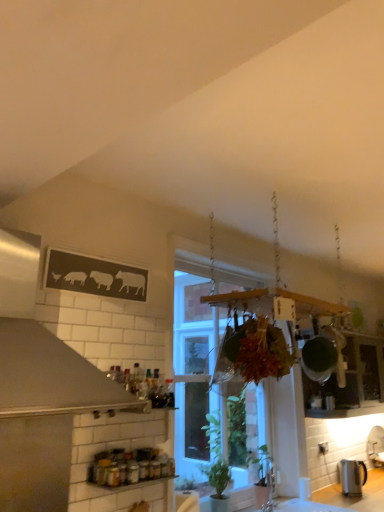
Find the location of a particular element. The width and height of the screenshot is (384, 512). satin silver kettle at lower right is located at coordinates (352, 477).

In order to face satin silver exhaust hood at upper left, should I rotate leftwards or rightwards?

Turn left approximately 18.641 degrees to face it.

What do you see at coordinates (194, 362) in the screenshot? I see `clear glass window at center` at bounding box center [194, 362].

At what (x,y) coordinates should I click in order to perform the action: click on satin silver kettle at lower right. Please return your answer as a coordinate pair (x, y). Looking at the image, I should click on (352, 477).

Based on their sizes in the image, would you say clear glass window at center is bigger or smaller than satin silver exhaust hood at upper left?

In the image, clear glass window at center appears to be larger than satin silver exhaust hood at upper left.

Is point (184, 480) closer or farther from the camera than point (48, 372)?

Point (184, 480) appears to be farther away from the viewer than point (48, 372).

Where is `window located below the satin silver exhaust hood at upper left (from the image's perspective)`? The image size is (384, 512). window located below the satin silver exhaust hood at upper left (from the image's perspective) is located at coordinates (194, 362).

Find the location of a particular element. This screenshot has height=512, width=384. window in front of the satin silver kettle at lower right is located at coordinates (194, 362).

Can you tell me how much satin silver kettle at lower right and clear glass window at center differ in facing direction?

There is a 4.87-degree angle between the facing directions of satin silver kettle at lower right and clear glass window at center.

Does satin silver kettle at lower right touch clear glass window at center?

satin silver kettle at lower right is not next to clear glass window at center, and they're not touching.

From the image's perspective, relative to clear glass window at center, is satin silver kettle at lower right above or below?

satin silver kettle at lower right is situated lower than clear glass window at center in the image.

This screenshot has width=384, height=512. Find the location of `exhaust hood on the left of metallic glass jars at lower center`. exhaust hood on the left of metallic glass jars at lower center is located at coordinates click(x=42, y=350).

Would you say satin silver exhaust hood at upper left is a long distance from metallic glass jars at lower center?

No, satin silver exhaust hood at upper left is in close proximity to metallic glass jars at lower center.

Is the depth of clear glass window at center less than that of satin silver kettle at lower right?

Yes, clear glass window at center is closer to the viewer.

Based on their positions, is clear glass window at center located to the left or right of satin silver kettle at lower right?

clear glass window at center is positioned on satin silver kettle at lower right's left side.

Can we say clear glass window at center lies outside satin silver kettle at lower right?

Indeed, clear glass window at center is completely outside satin silver kettle at lower right.

Is clear glass window at center not close to satin silver kettle at lower right?

Absolutely, clear glass window at center is distant from satin silver kettle at lower right.

Is metallic glass jars at lower center positioned behind satin silver exhaust hood at upper left?

Yes, it is.

Is metallic glass jars at lower center not near satin silver exhaust hood at upper left?

metallic glass jars at lower center is near satin silver exhaust hood at upper left, not far away.

Considering the positions of points (141, 483) and (115, 385), is point (141, 483) farther from camera compared to point (115, 385)?

That is True.

Identify the location of window sill lying on the right of satin silver exhaust hood at upper left. This screenshot has height=512, width=384. (131, 484).

Is satin silver exhaust hood at upper left to the right of clear glass window at center from the viewer's perspective?

No.

From a real-world perspective, is satin silver exhaust hood at upper left on top of clear glass window at center?

Yes.

The height and width of the screenshot is (512, 384). In order to click on window below the satin silver exhaust hood at upper left (from a real-world perspective) in this screenshot , I will do `click(194, 362)`.

Is metallic glass jars at lower center not near clear glass window at center?

Yes, metallic glass jars at lower center is far from clear glass window at center.

From a real-world perspective, is metallic glass jars at lower center located higher than clear glass window at center?

Incorrect, from a real-world perspective, metallic glass jars at lower center is lower than clear glass window at center.

Consider the image. In terms of height, does metallic glass jars at lower center look taller or shorter compared to clear glass window at center?

Considering their sizes, metallic glass jars at lower center has less height than clear glass window at center.

Consider the image. Measure the distance between metallic glass jars at lower center and clear glass window at center.

metallic glass jars at lower center and clear glass window at center are 2.19 meters apart.

What are the coordinates of `window directly beneath the satin silver exhaust hood at upper left (from a real-world perspective)` in the screenshot? It's located at (194, 362).

Locate an element on the screen. The height and width of the screenshot is (512, 384). window above the satin silver kettle at lower right (from a real-world perspective) is located at coordinates (194, 362).

Based on their spatial positions, is satin silver exhaust hood at upper left or satin silver kettle at lower right closer to metallic glass jars at lower center?

satin silver exhaust hood at upper left is positioned closer to the anchor metallic glass jars at lower center.

Estimate the real-world distances between objects in this image. Which object is closer to satin silver exhaust hood at upper left, clear glass window at center or metallic glass jars at lower center?

Among the two, metallic glass jars at lower center is located nearer to satin silver exhaust hood at upper left.

Based on their spatial positions, is satin silver kettle at lower right or metallic glass jars at lower center closer to satin silver exhaust hood at upper left?

Based on the image, metallic glass jars at lower center appears to be nearer to satin silver exhaust hood at upper left.

Which object lies nearer to the anchor point metallic glass jars at lower center, satin silver kettle at lower right or satin silver exhaust hood at upper left?

satin silver exhaust hood at upper left is closer to metallic glass jars at lower center.

When comparing their distances from satin silver kettle at lower right, does satin silver exhaust hood at upper left or metallic glass jars at lower center seem further?

satin silver exhaust hood at upper left.

Which object lies further to the anchor point clear glass window at center, metallic glass jars at lower center or satin silver kettle at lower right?

The object further to clear glass window at center is metallic glass jars at lower center.

From the image, which object appears to be nearer to satin silver kettle at lower right, satin silver exhaust hood at upper left or clear glass window at center?

The object closer to satin silver kettle at lower right is clear glass window at center.

From the picture: Which object lies further to the anchor point metallic glass jars at lower center, clear glass window at center or satin silver kettle at lower right?

Based on the image, clear glass window at center appears to be further to metallic glass jars at lower center.

Identify the location of window sill located between satin silver exhaust hood at upper left and satin silver kettle at lower right in the depth direction. (131, 484).

Where is `window sill between satin silver exhaust hood at upper left and clear glass window at center along the z-axis`? window sill between satin silver exhaust hood at upper left and clear glass window at center along the z-axis is located at coordinates (131, 484).

Find the location of a particular element. window between metallic glass jars at lower center and satin silver kettle at lower right from left to right is located at coordinates coord(194,362).

The height and width of the screenshot is (512, 384). I want to click on window located between satin silver exhaust hood at upper left and satin silver kettle at lower right in the depth direction, so click(194, 362).